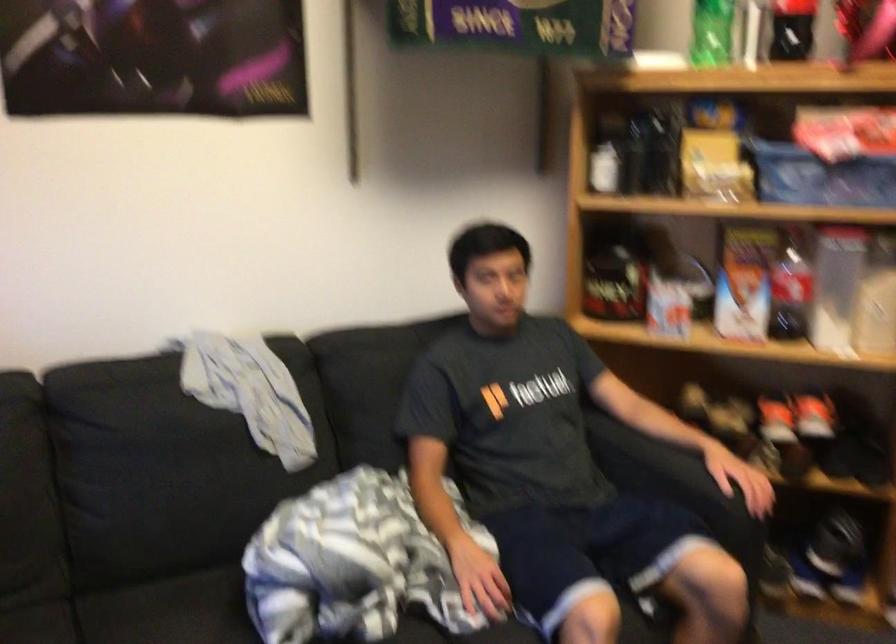
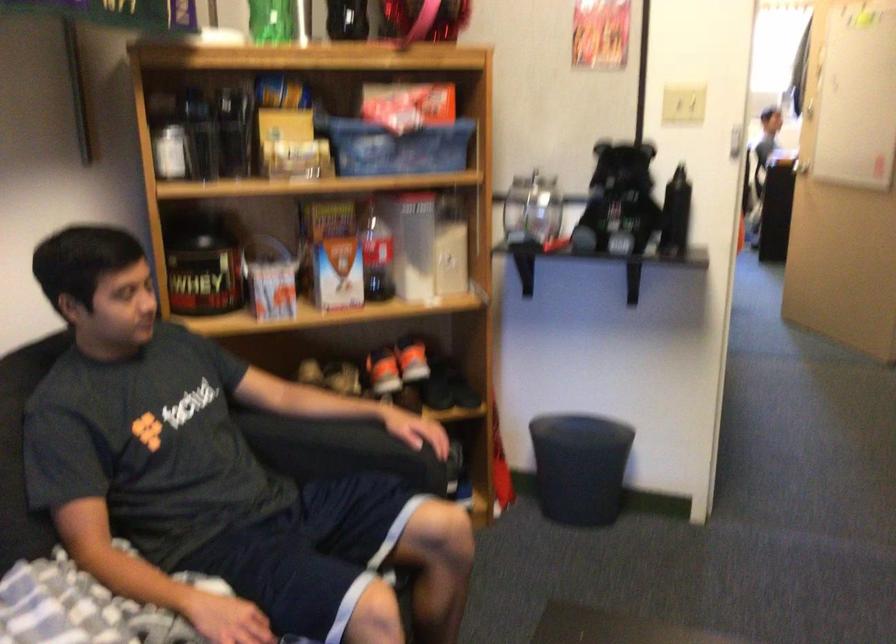
Where in the second image is the point corresponding to (x=786, y=289) from the first image?

(375, 254)